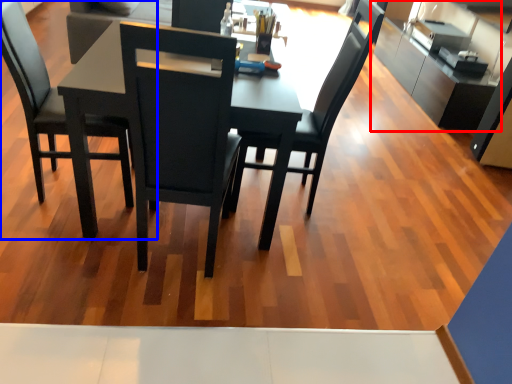
Question: Which object is closer to the camera taking this photo, cabinetry (highlighted by a red box) or chair (highlighted by a blue box)?

Choices:
 (A) cabinetry
 (B) chair

Answer: (B)